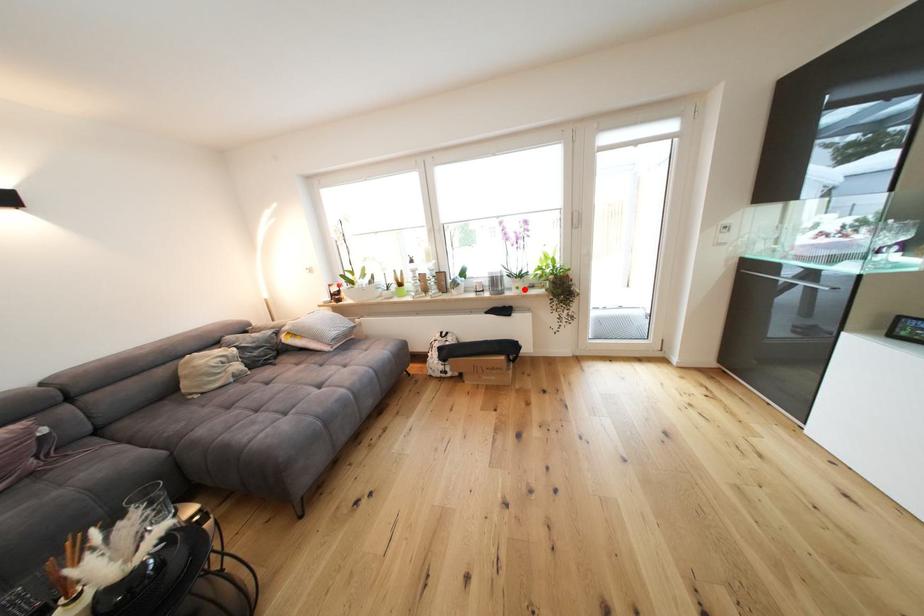
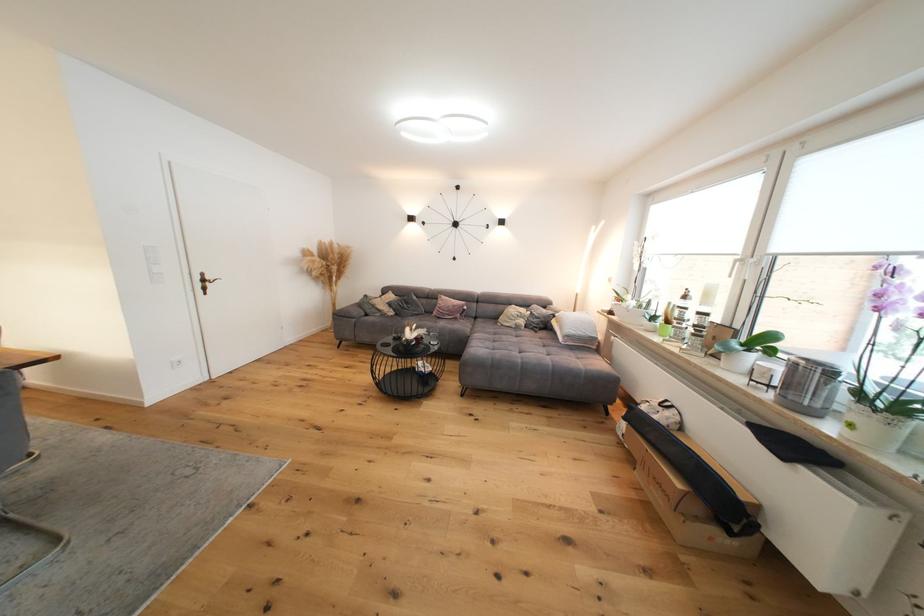
Question: A red point is marked in image1. In image2, is the corresponding 3D point closer to the camera or farther? Reply with the corresponding letter.

Choices:
 (A) The corresponding 3D point is closer.
 (B) The corresponding 3D point is farther.

Answer: (B)